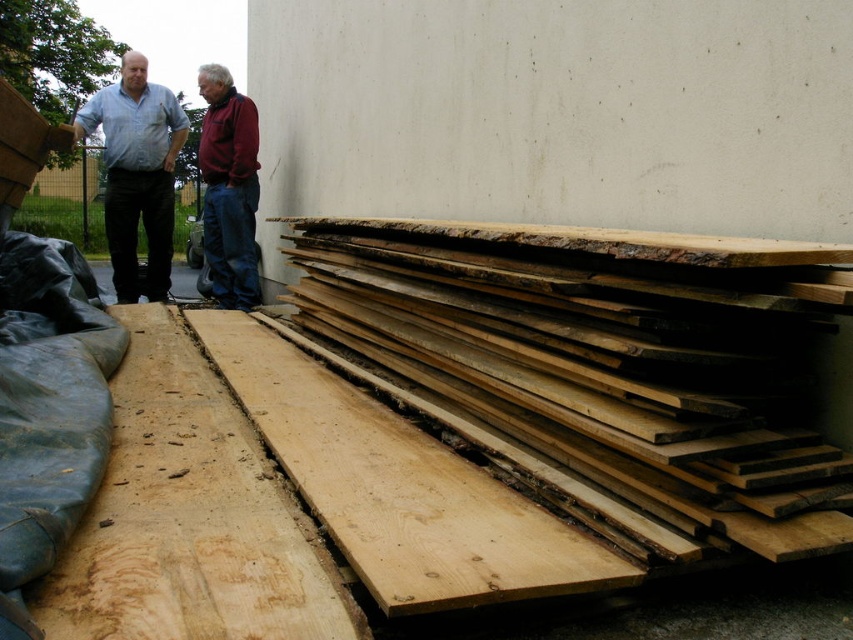
Is natural wood plank at center closer to the viewer compared to maroon fleece jacket at center?

Yes.

Which of these two, natural wood plank at center or maroon fleece jacket at center, stands taller?

maroon fleece jacket at center is taller.

At what (x,y) coordinates should I click in order to perform the action: click on natural wood plank at center. Please return your answer as a coordinate pair (x, y). Image resolution: width=853 pixels, height=640 pixels. Looking at the image, I should click on (398, 486).

Is light blue shirt at left wider than maroon fleece jacket at center?

Yes, light blue shirt at left is wider than maroon fleece jacket at center.

Does light blue shirt at left have a larger size compared to maroon fleece jacket at center?

No.

Who is more forward, (143, 97) or (236, 141)?

Point (236, 141) is in front.

In order to click on light blue shirt at left in this screenshot , I will do `click(136, 172)`.

Does natural wood plank at center have a larger size compared to light blue shirt at left?

Yes.

Between natural wood plank at center and light blue shirt at left, which one appears on the right side from the viewer's perspective?

From the viewer's perspective, natural wood plank at center appears more on the right side.

Describe the element at coordinates (398, 486) in the screenshot. I see `natural wood plank at center` at that location.

At what (x,y) coordinates should I click in order to perform the action: click on natural wood plank at center. Please return your answer as a coordinate pair (x, y). The width and height of the screenshot is (853, 640). Looking at the image, I should click on (398, 486).